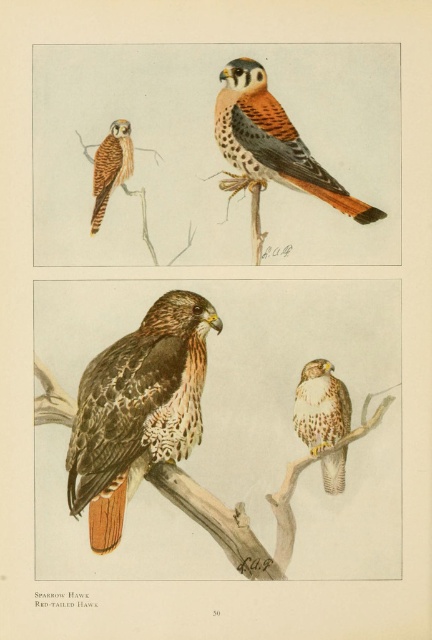
Question: Can you confirm if brown speckled falcon at center is positioned to the right of spotted feathered falcon at upper left?

Choices:
 (A) no
 (B) yes

Answer: (B)

Question: Which point is closer to the camera?

Choices:
 (A) spotted feathered falcon at upper center
 (B) brown speckled falcon at center
 (C) brown speckled feathers at center
 (D) spotted feathered falcon at upper left

Answer: (C)

Question: Which of these objects is positioned closest to the spotted feathered falcon at upper center?

Choices:
 (A) brown speckled feathers at center
 (B) spotted feathered falcon at upper left
 (C) brown speckled falcon at center

Answer: (B)

Question: Is brown speckled feathers at center closer to camera compared to spotted feathered falcon at upper center?

Choices:
 (A) yes
 (B) no

Answer: (A)

Question: Among these points, which one is farthest from the camera?

Choices:
 (A) (345, 449)
 (B) (314, 186)
 (C) (114, 150)
 (D) (127, 400)

Answer: (C)

Question: Does spotted feathered falcon at upper center have a greater width compared to brown speckled falcon at center?

Choices:
 (A) yes
 (B) no

Answer: (A)